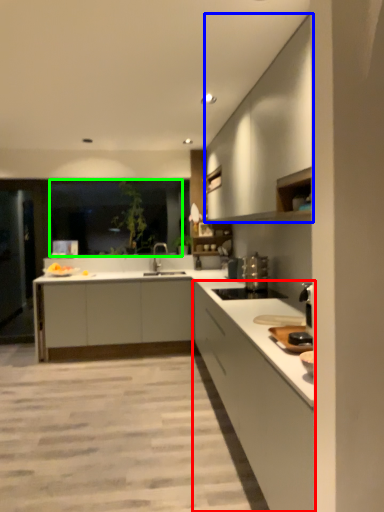
Question: Which is nearer to the cabinetry (highlighted by a red box)? cabinetry (highlighted by a blue box) or window screen (highlighted by a green box).

Choices:
 (A) cabinetry
 (B) window screen

Answer: (A)